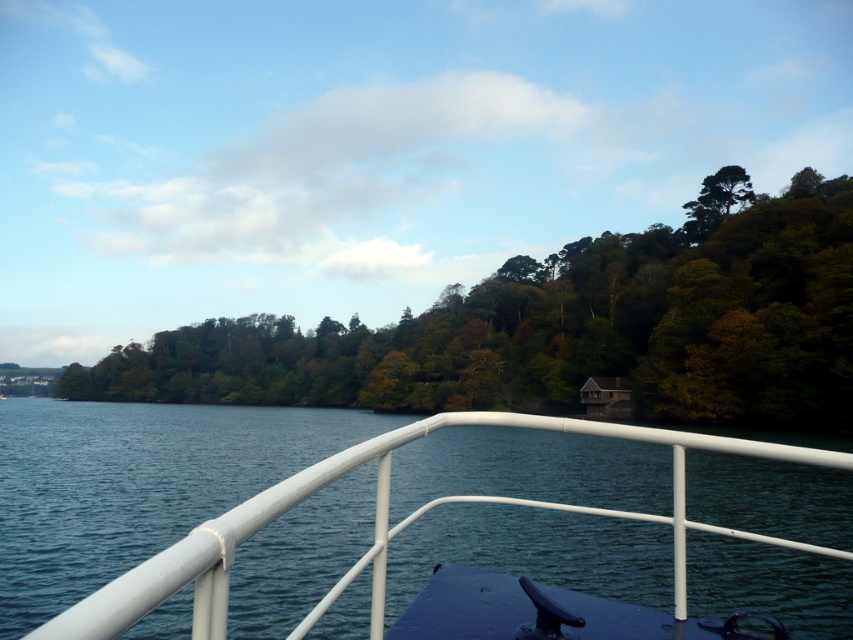
Question: Is the position of white metal boat at center less distant than that of green leafy trees at center?

Choices:
 (A) no
 (B) yes

Answer: (B)

Question: Is white metal boat at center to the left of green leafy trees at center from the viewer's perspective?

Choices:
 (A) no
 (B) yes

Answer: (A)

Question: Which point is farther to the camera?

Choices:
 (A) (180, 392)
 (B) (113, 474)

Answer: (A)

Question: Which of the following is the farthest from the observer?

Choices:
 (A) (270, 324)
 (B) (125, 438)

Answer: (A)

Question: Does white metal boat at center appear on the left side of green leafy trees at center?

Choices:
 (A) yes
 (B) no

Answer: (B)

Question: Which object appears closest to the camera in this image?

Choices:
 (A) green leafy trees at center
 (B) white metal boat at center

Answer: (B)